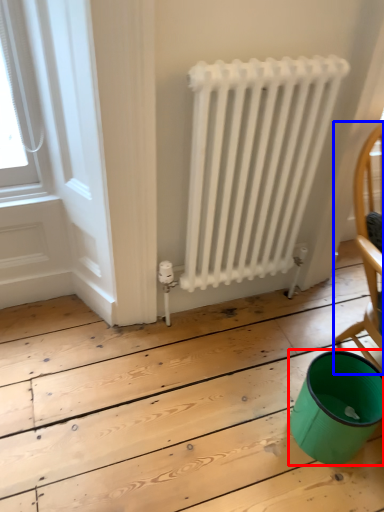
Question: Among these objects, which one is nearest to the camera, teal (highlighted by a red box) or chair (highlighted by a blue box)?

Choices:
 (A) teal
 (B) chair

Answer: (A)